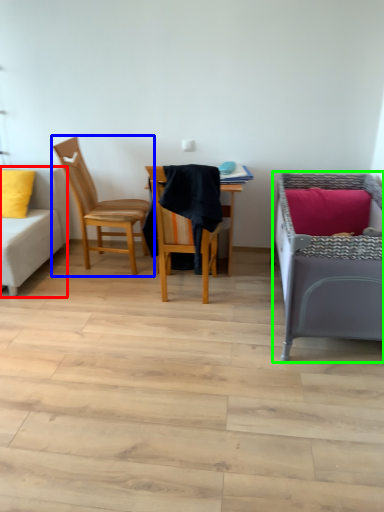
Question: Considering the real-world distances, which object is farthest from studio couch (highlighted by a red box)? chair (highlighted by a blue box) or infant bed (highlighted by a green box)?

Choices:
 (A) chair
 (B) infant bed

Answer: (B)